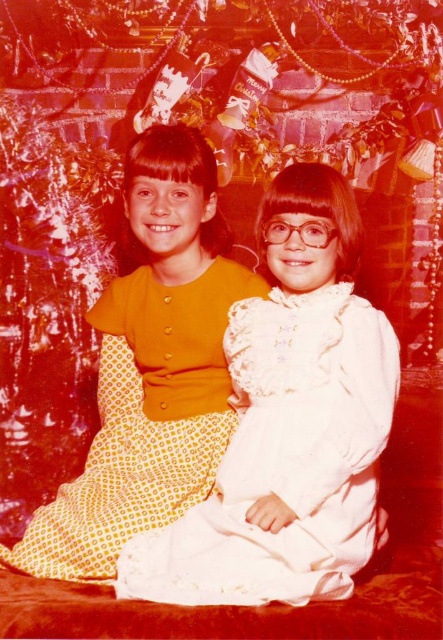
You are a photographer setting up a tripod at coordinates 0.5, 0.5. You need to ensure that the white lace dress at center is in the frame. Based on its position at 0.719, 0.643, will the dress be visible in your current setup?

The white lace dress at center is located at point (284, 460), which is outside the tripod setup at (221, 320). Therefore, the dress may not be fully visible unless the camera angle is adjusted to include the area around (284, 460).

You are a photographer trying to capture a group photo of two girls wearing the white lace dress at center and the yellow dotted dress at center. Based on their current positions, which girl should you instruct to move to the left to create space between them?

The girl wearing the white lace dress at center should move to the left since she is currently positioned on the right side of the yellow dotted dress at center.

You are a photographer trying to capture a closeup shot of the girl on the left. You have a camera with a zoom lens that can focus on a specific point. The two points you can choose are point (x=221, y=486) and point (x=167, y=140). Which point should you focus on to ensure the girl on the left is in sharp focus?

Point (x=221, y=486) is in front of point (x=167, y=140), so focusing on point (x=221, y=486) will ensure the girl on the left is in sharp focus.